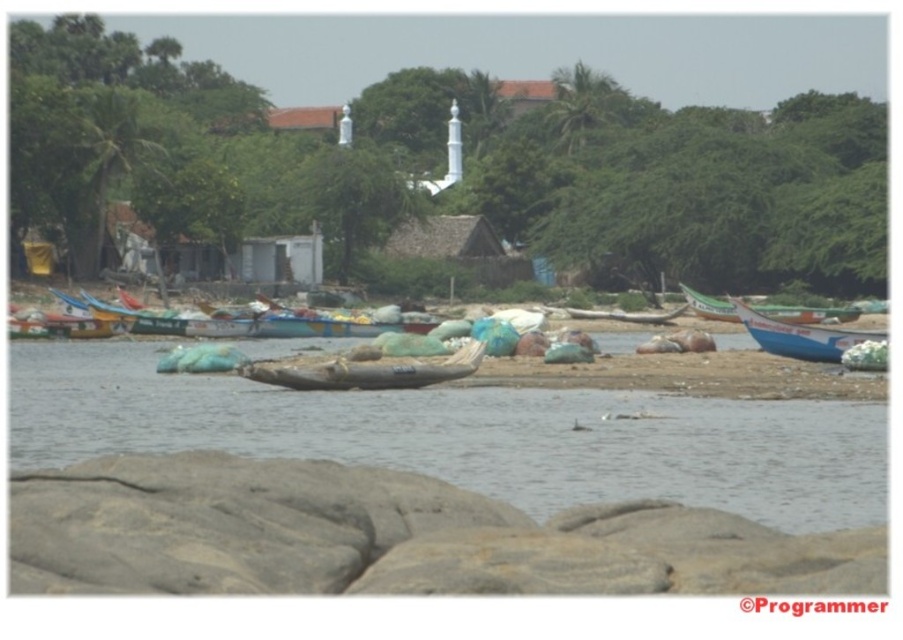
You are standing on the rocky shoreline and want to walk towards the blue plastic boat at right. Is the brown matte water at center between you and the boat?

Yes, the brown matte water at center is between you and the blue plastic boat at right because it is in front of the boat from your perspective on the shoreline.

Looking at this image, you are a sailor who needs to anchor your boat 15 meters away from the brown matte water at center. Can you safely anchor the blue plastic boat at right in the current location?

The distance between the brown matte water at center and the blue plastic boat at right is 14.51 meters, which is less than the required 15 meters. Therefore, anchoring the blue plastic boat at right here would not meet the safety requirement.

You are standing at the shoreline looking out at the boats. Which of the two points, point (817, 348) or point (110, 333), is closer to you?

Point (817, 348) is closer to the viewer than point (110, 333).